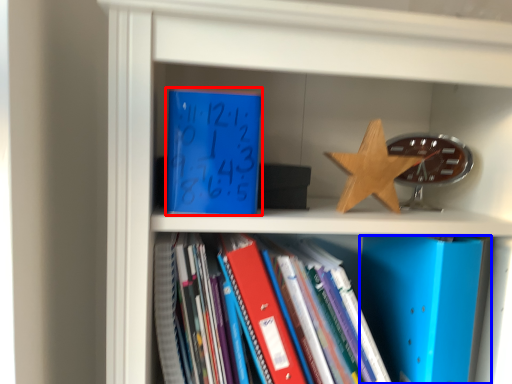
Question: Which of the following is the farthest to the observer, paperback book (highlighted by a red box) or paperback book (highlighted by a blue box)?

Choices:
 (A) paperback book
 (B) paperback book

Answer: (B)